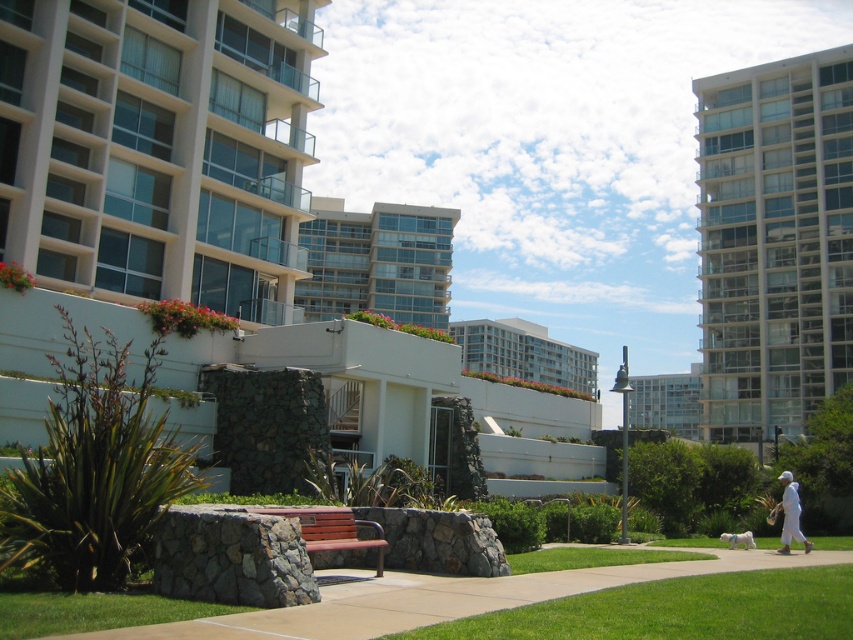
Question: Among these objects, which one is nearest to the camera?

Choices:
 (A) white glossy building at center
 (B) white glass building at center

Answer: (B)

Question: Can you confirm if white glass building at upper left is thinner than concrete pavement at center?

Choices:
 (A) no
 (B) yes

Answer: (B)

Question: Does white glossy building at center have a larger size compared to white matte person at lower right?

Choices:
 (A) yes
 (B) no

Answer: (A)

Question: Which point appears closest to the camera in this image?

Choices:
 (A) (422, 580)
 (B) (798, 490)

Answer: (A)

Question: Is concrete pavement at center smaller than white glass building at center?

Choices:
 (A) yes
 (B) no

Answer: (A)

Question: Estimate the real-world distances between objects in this image. Which object is farther from the white glass building at upper left?

Choices:
 (A) white glass building at center
 (B) green grass at lower center

Answer: (A)